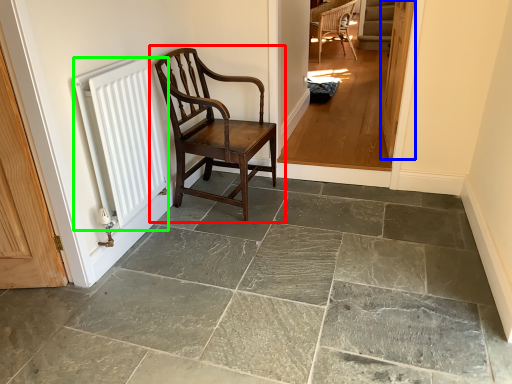
Question: Which object is positioned farthest from chair (highlighted by a red box)? Select from door (highlighted by a blue box) and radiator (highlighted by a green box).

Choices:
 (A) door
 (B) radiator

Answer: (A)